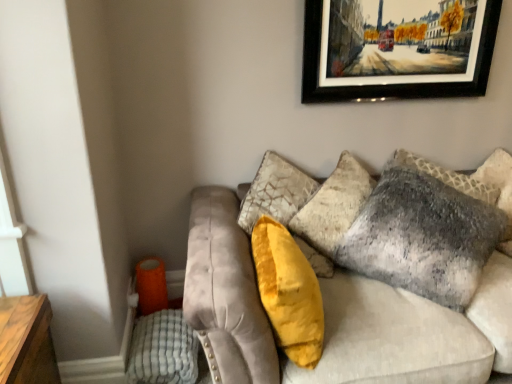
Question: Considering the relative sizes of velvet gray couch at center and textured gray pillow at upper right, marked as the second pillow in a right-to-left arrangement, in the image provided, is velvet gray couch at center thinner than textured gray pillow at upper right, marked as the second pillow in a right-to-left arrangement,?

Choices:
 (A) no
 (B) yes

Answer: (A)

Question: Does velvet gray couch at center have a lesser height compared to textured gray pillow at upper right, marked as the second pillow in a right-to-left arrangement?

Choices:
 (A) yes
 (B) no

Answer: (A)

Question: Can you confirm if velvet gray couch at center is smaller than textured gray pillow at upper right, which ranks as the second pillow in left-to-right order?

Choices:
 (A) no
 (B) yes

Answer: (A)

Question: Is velvet gray couch at center bigger than textured gray pillow at upper right, marked as the second pillow in a right-to-left arrangement?

Choices:
 (A) no
 (B) yes

Answer: (B)

Question: From the image's perspective, is velvet gray couch at center below textured gray pillow at upper right, which ranks as the second pillow in left-to-right order?

Choices:
 (A) yes
 (B) no

Answer: (A)

Question: Is textured gray pillow at upper right, marked as the second pillow in a right-to-left arrangement, in front of or behind wooden-framed painting at upper center in the image?

Choices:
 (A) behind
 (B) front

Answer: (B)

Question: Is point (444, 231) positioned closer to the camera than point (460, 52)?

Choices:
 (A) farther
 (B) closer

Answer: (B)

Question: Based on their sizes in the image, would you say textured gray pillow at upper right, which ranks as the second pillow in left-to-right order, is bigger or smaller than wooden-framed painting at upper center?

Choices:
 (A) big
 (B) small

Answer: (A)

Question: Considering the positions of textured gray pillow at upper right, marked as the second pillow in a right-to-left arrangement, and wooden-framed painting at upper center in the image, is textured gray pillow at upper right, marked as the second pillow in a right-to-left arrangement, wider or thinner than wooden-framed painting at upper center?

Choices:
 (A) thin
 (B) wide

Answer: (B)

Question: From the image's perspective, is velvet gray couch at center above or below textured gray pillow at upper right, which is the 3th pillow in left-to-right order?

Choices:
 (A) below
 (B) above

Answer: (A)

Question: Is velvet gray couch at center inside or outside of textured gray pillow at upper right, which is the 3th pillow in left-to-right order?

Choices:
 (A) outside
 (B) inside

Answer: (A)

Question: Looking at their shapes, would you say velvet gray couch at center is wider or thinner than textured gray pillow at upper right, which is the 3th pillow in left-to-right order?

Choices:
 (A) wide
 (B) thin

Answer: (A)

Question: Is velvet gray couch at center bigger or smaller than textured gray pillow at upper right, the first pillow positioned from the right?

Choices:
 (A) big
 (B) small

Answer: (A)

Question: From a real-world perspective, is wooden-framed painting at upper center above or below textured gray pillow at upper right, which ranks as the second pillow in left-to-right order?

Choices:
 (A) above
 (B) below

Answer: (A)

Question: Relative to textured gray pillow at upper right, which ranks as the second pillow in left-to-right order, is wooden-framed painting at upper center in front or behind?

Choices:
 (A) front
 (B) behind

Answer: (B)